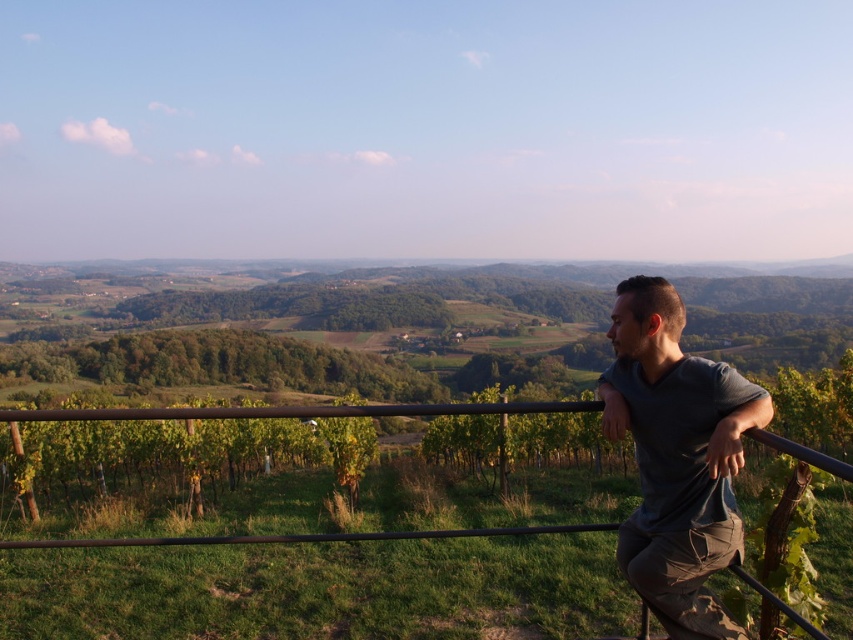
Question: Can you confirm if gray cotton shirt at right is positioned above black metal fence at lower right?

Choices:
 (A) no
 (B) yes

Answer: (B)

Question: Which point is farther from the camera taking this photo?

Choices:
 (A) (657, 608)
 (B) (218, 541)

Answer: (B)

Question: Is gray cotton shirt at right thinner than black metal fence at lower right?

Choices:
 (A) no
 (B) yes

Answer: (B)

Question: Does gray cotton shirt at right appear over black metal fence at lower right?

Choices:
 (A) no
 (B) yes

Answer: (B)